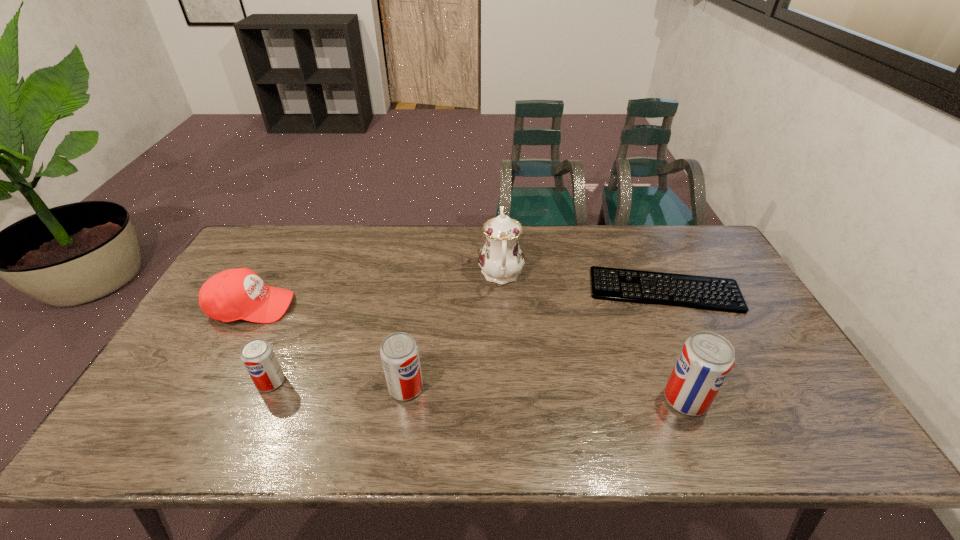
Locate an element on the screen. The width and height of the screenshot is (960, 540). the shortest soda is located at coordinates (257, 355).

Identify the location of the fourth object from right to left. 399,352.

Locate an element on the screen. Image resolution: width=960 pixels, height=540 pixels. the third tallest object is located at coordinates (399, 352).

Identify the location of the rightmost soda. (706, 359).

Where is `the tallest soda`? The width and height of the screenshot is (960, 540). the tallest soda is located at coordinates (706, 359).

You are a GUI agent. You are given a task and a screenshot of the screen. Output one action in this format:
    pyautogui.click(x=<x>, y=<y>)
    Task: Click on the chinaware
    
    Given the screenshot: What is the action you would take?
    pyautogui.click(x=501, y=259)

The image size is (960, 540). In order to click on baseball cap in this screenshot , I will do `click(234, 294)`.

At what (x,y) coordinates should I click in order to perform the action: click on the shortest object. Please return your answer as a coordinate pair (x, y). This screenshot has width=960, height=540. Looking at the image, I should click on point(727,293).

Image resolution: width=960 pixels, height=540 pixels. Find the location of `blank area located 0.200m on the left of the leftmost soda`. blank area located 0.200m on the left of the leftmost soda is located at coordinates (178, 382).

Locate an element on the screen. Image resolution: width=960 pixels, height=540 pixels. free space located 0.390m on the back of the fourth shortest object is located at coordinates (422, 274).